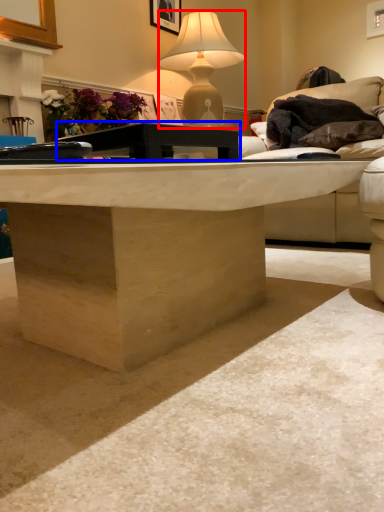
Question: Which of the following is the closest to the observer, lamp (highlighted by a red box) or table (highlighted by a blue box)?

Choices:
 (A) lamp
 (B) table

Answer: (B)